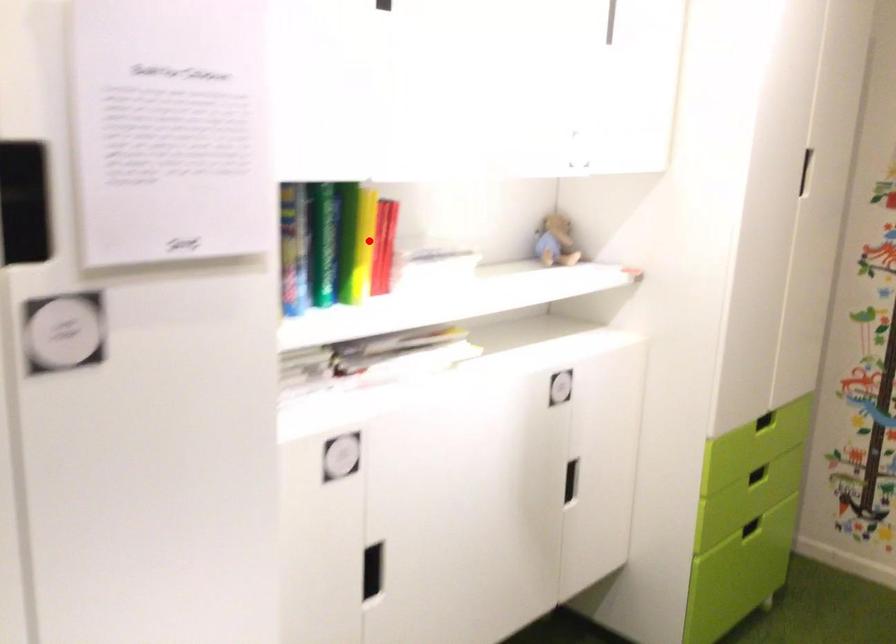
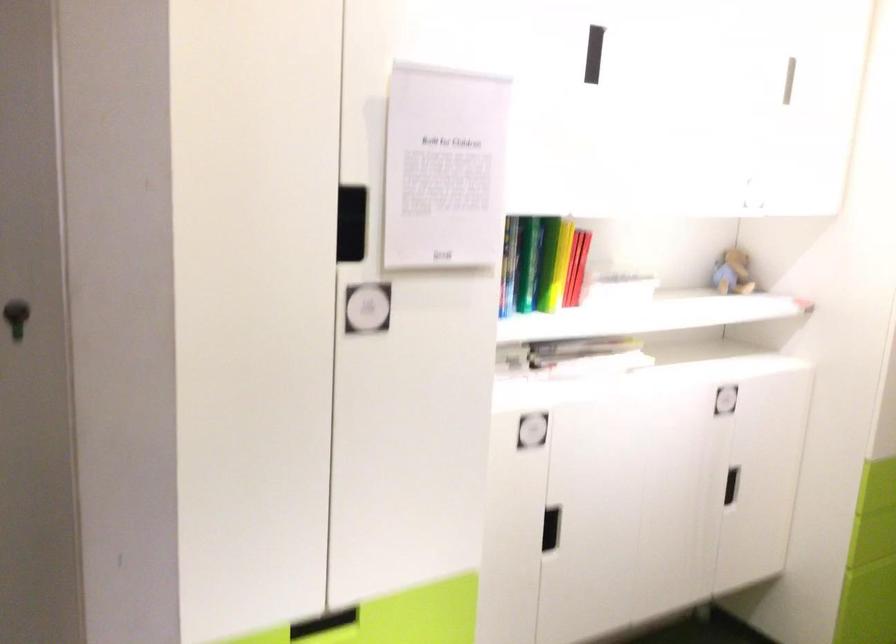
Locate, in the second image, the point that corresponds to the highlighted location in the first image.

(561, 263)